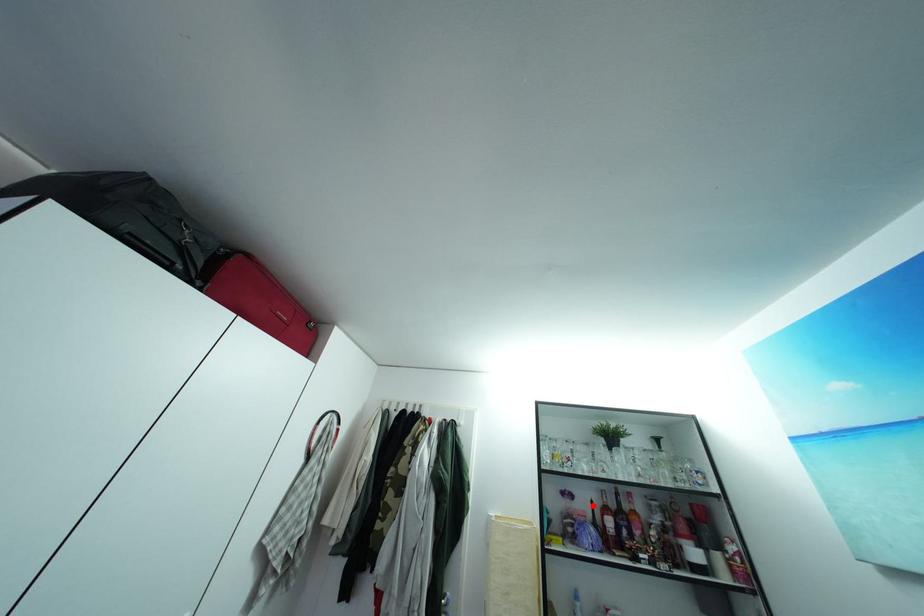
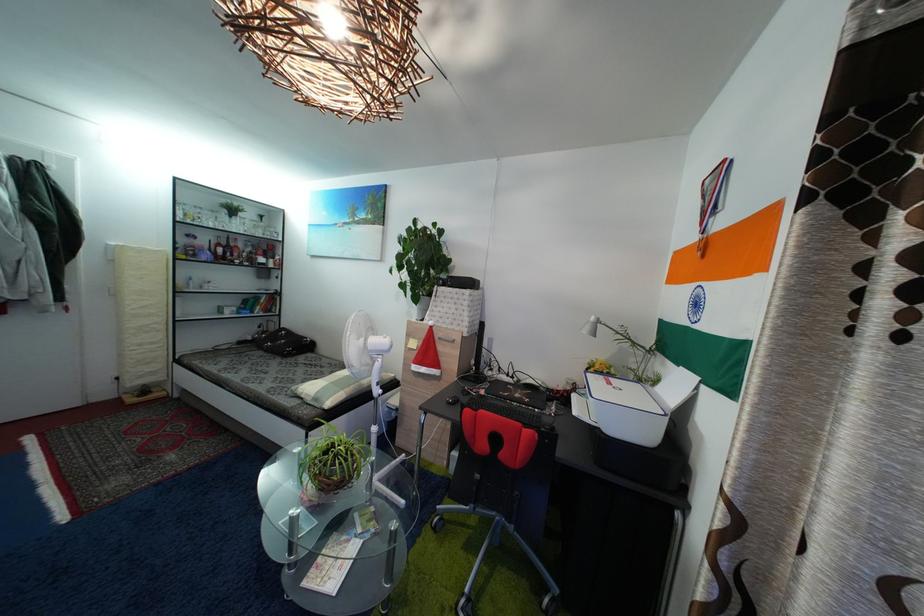
Find the pixel in the second image that matches the highlighted location in the first image.

(213, 246)